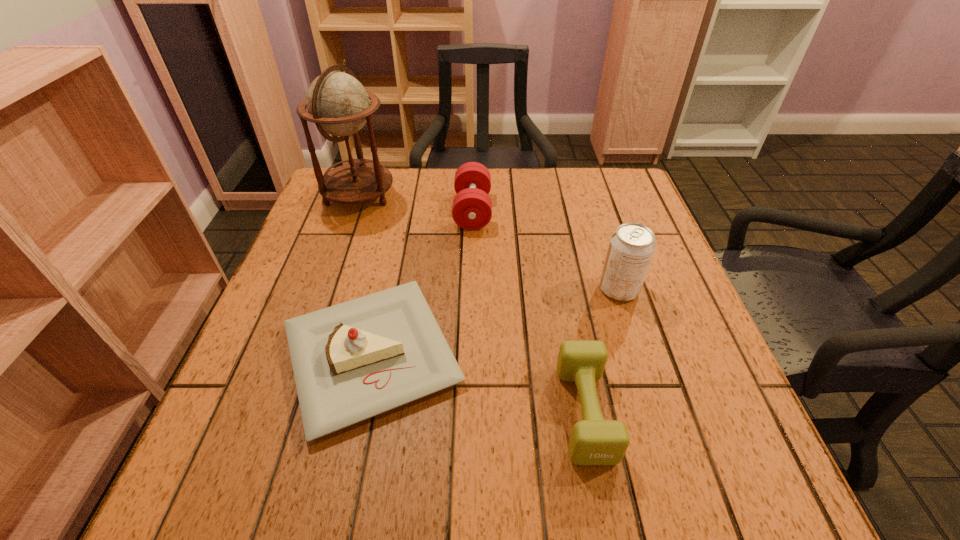
Find the location of `object positioned at the far left corner`. object positioned at the far left corner is located at coordinates (338, 104).

Find the location of a particular element. This screenshot has width=960, height=540. object that is positioned at the near left corner is located at coordinates (352, 361).

In the image, there is a desktop. Identify the location of free space at the far edge. The height and width of the screenshot is (540, 960). (502, 213).

In the image, there is a desktop. Where is `free space at the near edge`? The height and width of the screenshot is (540, 960). free space at the near edge is located at coordinates (561, 458).

The height and width of the screenshot is (540, 960). In the image, there is a desktop. Identify the location of vacant area at the left edge. (318, 248).

In the image, there is a desktop. Identify the location of vacant space at the right edge. Image resolution: width=960 pixels, height=540 pixels. (660, 411).

What are the coordinates of `blank space at the far right corner of the desktop` in the screenshot? It's located at (597, 206).

Locate an element on the screen. The width and height of the screenshot is (960, 540). vacant space at the near right corner of the desktop is located at coordinates (704, 503).

Find the location of `vacant area that lies between the cake and the soda can`. vacant area that lies between the cake and the soda can is located at coordinates (495, 322).

Image resolution: width=960 pixels, height=540 pixels. In order to click on blank region between the taller dumbbell and the cake in this screenshot , I will do `click(422, 283)`.